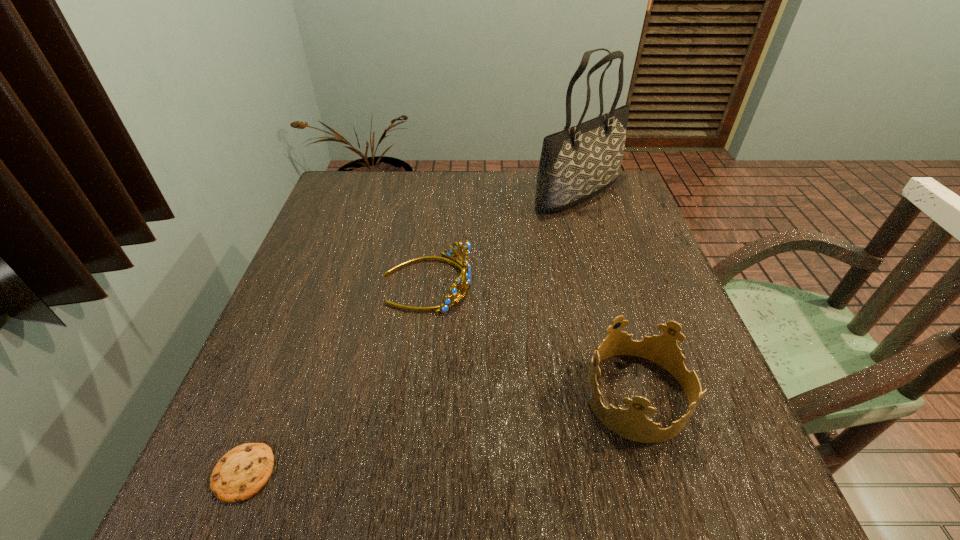
The image size is (960, 540). I want to click on object that is at the far right corner, so click(577, 163).

Find the location of a particular element. free region at the far edge of the desktop is located at coordinates (438, 198).

Identify the location of vacant space at the near edge of the desktop. Image resolution: width=960 pixels, height=540 pixels. (442, 471).

The width and height of the screenshot is (960, 540). I want to click on free space at the left edge, so click(x=316, y=328).

Find the location of a particular element. free spot at the right edge of the desktop is located at coordinates (645, 278).

At what (x,y) coordinates should I click in order to perform the action: click on free space at the far left corner of the desktop. Please return your answer as a coordinate pair (x, y). This screenshot has width=960, height=540. Looking at the image, I should click on (334, 191).

I want to click on vacant region at the far right corner of the desktop, so click(599, 205).

The width and height of the screenshot is (960, 540). In the image, there is a desktop. In order to click on vacant space at the near right corner in this screenshot , I will do pyautogui.click(x=737, y=467).

Where is `empty space between the leftmost object and the nearer tiara`? empty space between the leftmost object and the nearer tiara is located at coordinates (441, 434).

Image resolution: width=960 pixels, height=540 pixels. What are the coordinates of `vacant point located between the third object from right to left and the right tiara` in the screenshot? It's located at (532, 339).